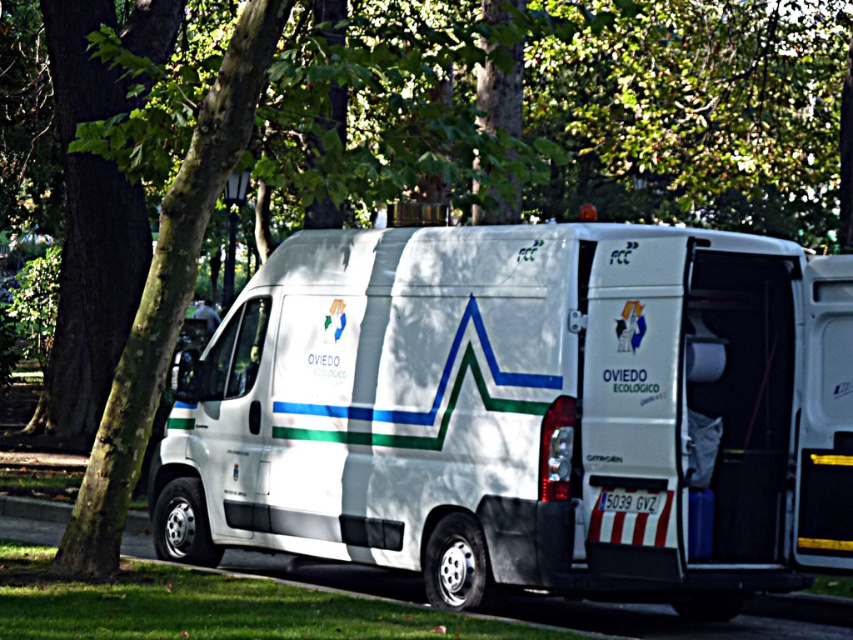
Question: Does white matte van at center have a lesser width compared to green leafy tree at upper left?

Choices:
 (A) yes
 (B) no

Answer: (A)

Question: Does white matte van at center have a greater width compared to green leafy tree at upper left?

Choices:
 (A) no
 (B) yes

Answer: (A)

Question: Which point is closer to the camera taking this photo?

Choices:
 (A) (604, 104)
 (B) (320, 483)

Answer: (B)

Question: Which point is farther to the camera?

Choices:
 (A) green leafy tree at upper left
 (B) white matte van at center

Answer: (A)

Question: Is white matte van at center thinner than green leafy tree at upper left?

Choices:
 (A) no
 (B) yes

Answer: (B)